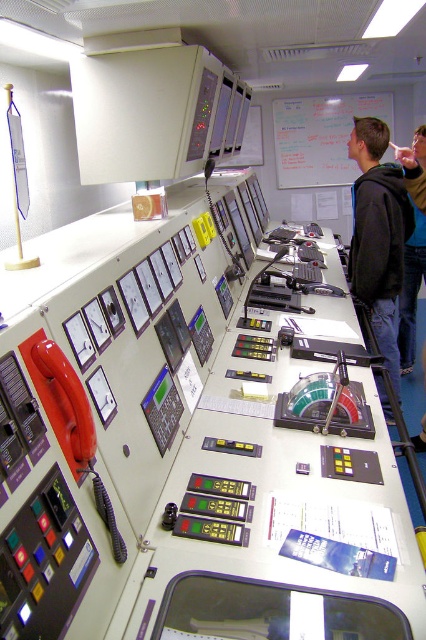
In the scene shown: Can you confirm if dark gray hoodie at center is taller than blue denim jeans at lower right?

No, dark gray hoodie at center is not taller than blue denim jeans at lower right.

Who is taller, dark gray hoodie at center or blue denim jeans at lower right?

blue denim jeans at lower right is taller.

Image resolution: width=426 pixels, height=640 pixels. Describe the element at coordinates (379, 236) in the screenshot. I see `dark gray hoodie at center` at that location.

In order to click on dark gray hoodie at center in this screenshot , I will do `click(379, 236)`.

Is point (379, 291) behind point (305, 125)?

No, (379, 291) is in front of (305, 125).

Who is positioned more to the left, dark gray hoodie at center or whiteboard at upper center?

From the viewer's perspective, dark gray hoodie at center appears more on the left side.

Find the location of a particular element. dark gray hoodie at center is located at coordinates pos(379,236).

The height and width of the screenshot is (640, 426). Identify the location of whiteboard at upper center. (321, 138).

Find the location of `whiteboard at upper center`. whiteboard at upper center is located at coordinates (321, 138).